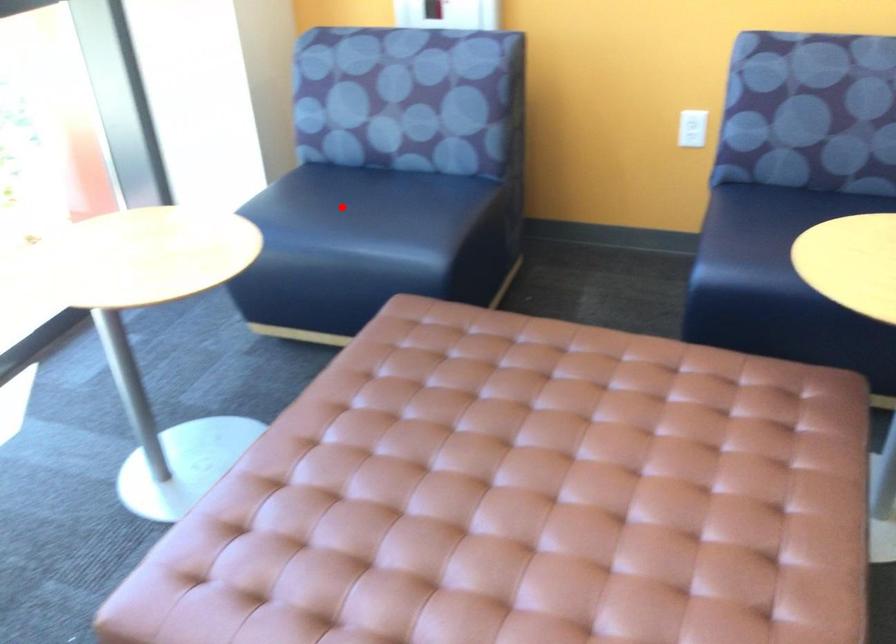
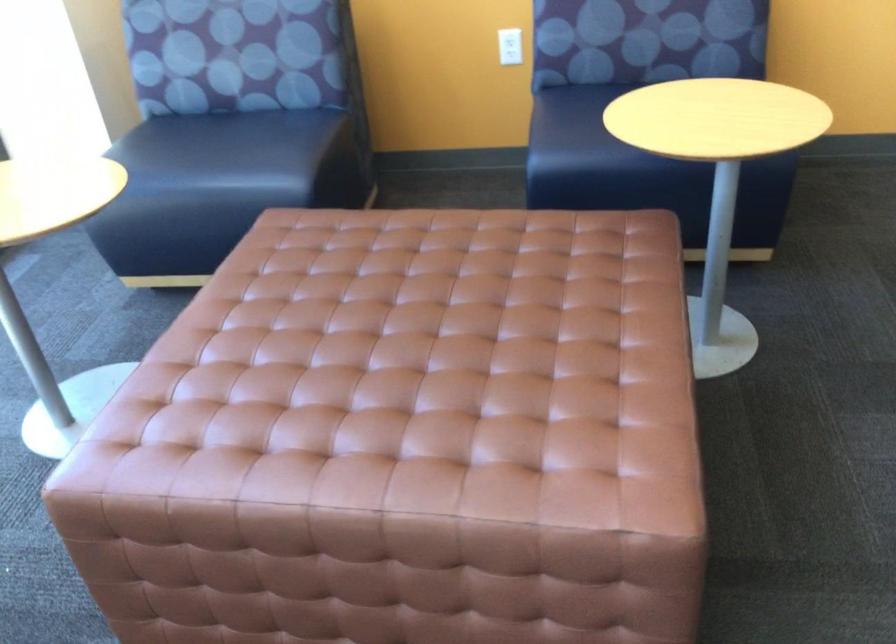
In the second image, find the point that corresponds to the highlighted location in the first image.

(199, 149)